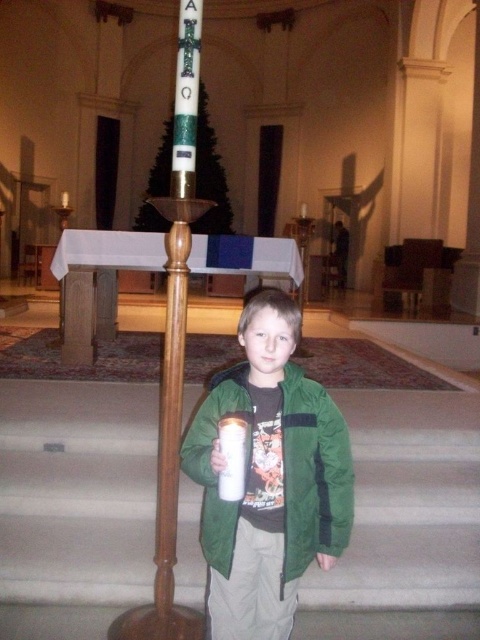
From the picture: You are a visitor in the church and want to place a small decoration between the wooden pole at center and the white frosted glass at center. Considering their sizes, which object should you place the decoration closer to?

The wooden pole at center is larger than the white frosted glass at center, so you should place the decoration closer to the white frosted glass at center to maintain balance.

You are a photographer standing in the church and want to take a picture of the green matte jacket at center and the wooden pole at center. If you want to ensure both objects are fully visible in your frame, which object should you position closer to the camera?

The green matte jacket at center might be wider than the wooden pole at center, so positioning the green matte jacket at center closer to the camera would help ensure both objects fit within the frame.

You are an architect designing a new church. You need to place a small statue between the wooden pole at center and the white frosted glass at center. Which object should the statue be closer to if it needs to be placed at a lower height?

The statue should be placed closer to the white frosted glass at center because it is shorter than the wooden pole at center, allowing the statue to be at a lower height.